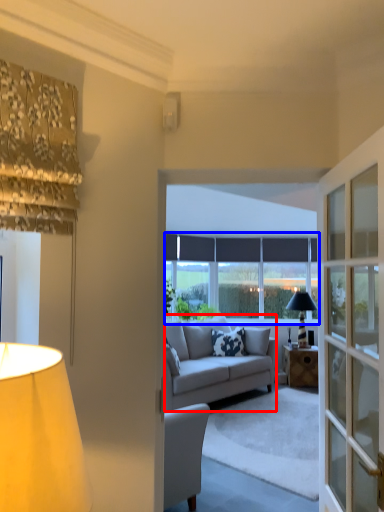
Question: Among these objects, which one is nearest to the camera, studio couch (highlighted by a red box) or window (highlighted by a blue box)?

Choices:
 (A) studio couch
 (B) window

Answer: (A)